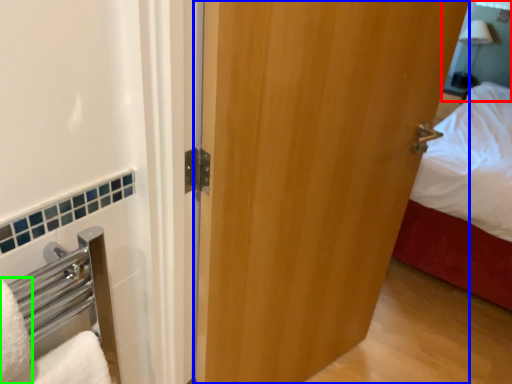
Question: Estimate the real-world distances between objects in this image. Which object is farther from mirror (highlighted by a red box), door (highlighted by a blue box) or bath towel (highlighted by a green box)?

Choices:
 (A) door
 (B) bath towel

Answer: (B)